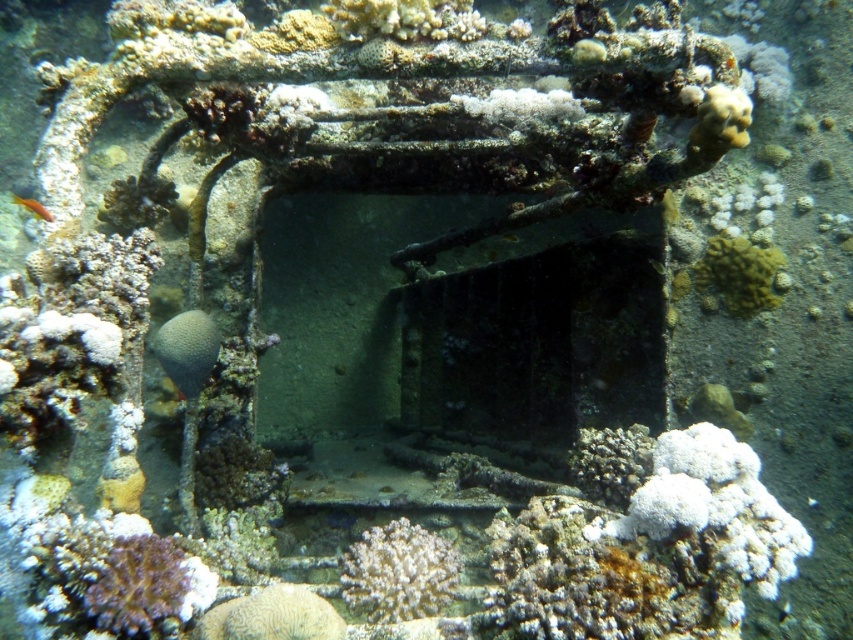
You are a marine biologist observing the underwater scene. You notice the yellow coral at center and the orange matte fish at lower left. Which object occupies a larger horizontal space in the image?

The orange matte fish at lower left has a greater width than the yellow coral at center, so it occupies a larger horizontal space.

You are a marine biologist examining the underwater scene. You notice two corals at the center of the image, the white coral at center and the yellow coral at center. Which one has a greater width?

The white coral at center might be wider than yellow coral at center.

You are a marine biologist observing an underwater scene. You notice two corals at the center of the image, a white coral at center and a yellow coral at center. Which one is located to the left of the other?

The white coral at center is positioned on the left side of yellow coral at center.